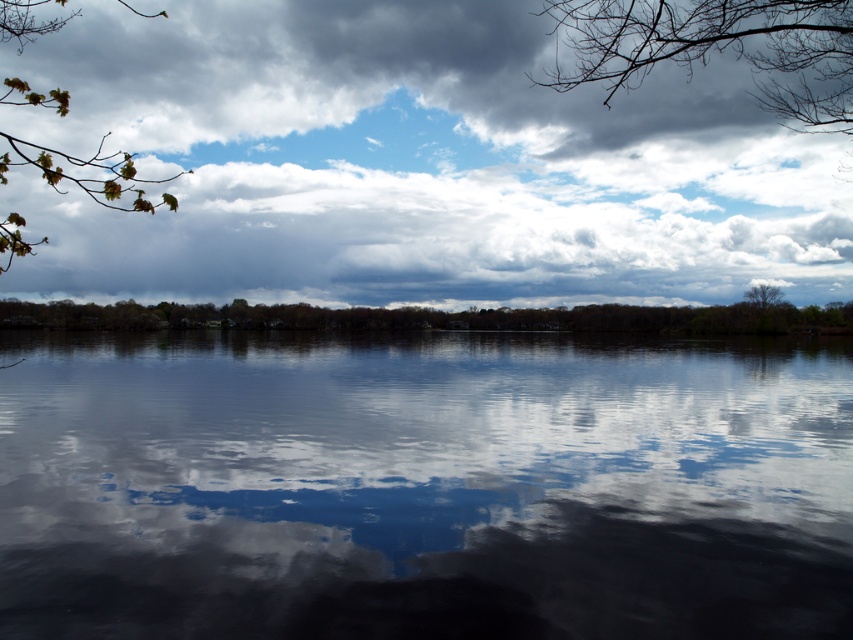
Is the position of green leafy branch at upper left more distant than that of bare branches at upper right?

That is False.

Find the location of a particular element. green leafy branch at upper left is located at coordinates (86, 173).

This screenshot has height=640, width=853. I want to click on green leafy branch at upper left, so click(86, 173).

Describe the element at coordinates (422, 486) in the screenshot. Image resolution: width=853 pixels, height=640 pixels. I see `smooth dark water at center` at that location.

Does smooth dark water at center appear on the right side of bare branches at upper center?

No, smooth dark water at center is not to the right of bare branches at upper center.

Is point (254, 429) positioned after point (595, 67)?

Yes, point (254, 429) is farther from viewer.

Where is `smooth dark water at center`? The height and width of the screenshot is (640, 853). smooth dark water at center is located at coordinates (422, 486).

Is bare branches at upper center wider than bare branches at upper right?

Indeed, bare branches at upper center has a greater width compared to bare branches at upper right.

Does bare branches at upper center have a larger size compared to bare branches at upper right?

Yes, bare branches at upper center is bigger than bare branches at upper right.

Identify the location of bare branches at upper center. (717, 49).

Locate an element on the screen. The image size is (853, 640). bare branches at upper center is located at coordinates pyautogui.click(x=717, y=49).